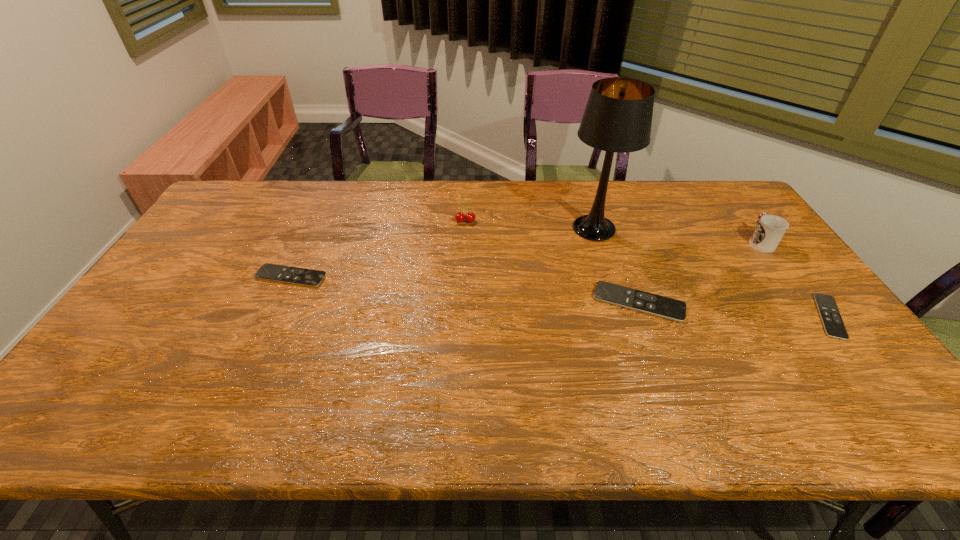
I want to click on the closest remote control relative to the rightmost remote control, so click(x=668, y=308).

What are the coordinates of `free location that satisfies the following two spatial constraints: 1. with the stems of the cherry pointing upwards; 2. on the left side of the shortest object` in the screenshot? It's located at (462, 316).

The image size is (960, 540). Identify the location of free point that satisfies the following two spatial constraints: 1. with the stems of the cherry pointing upwards; 2. on the left side of the tallest object. (465, 228).

Where is `vacant space that satisfies the following two spatial constraints: 1. with the stems of the shortest remote control pointing upwards; 2. on the left side of the cherry`? The image size is (960, 540). vacant space that satisfies the following two spatial constraints: 1. with the stems of the shortest remote control pointing upwards; 2. on the left side of the cherry is located at coordinates (462, 316).

Find the location of a particular element. The image size is (960, 540). vacant space that satisfies the following two spatial constraints: 1. with the stems of the second remote control from left to right pointing upwards; 2. on the left side of the fifth object from right to left is located at coordinates (462, 302).

Where is `vacant space that satisfies the following two spatial constraints: 1. with the stems of the second object from left to right pointing upwards; 2. on the right side of the tallest remote control`? The image size is (960, 540). vacant space that satisfies the following two spatial constraints: 1. with the stems of the second object from left to right pointing upwards; 2. on the right side of the tallest remote control is located at coordinates (462, 302).